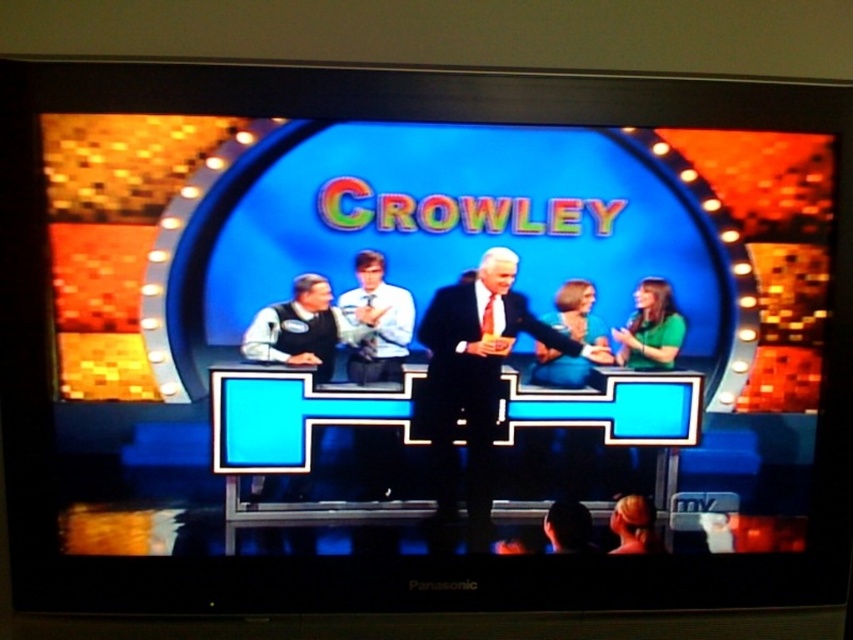
Does blonde hair at center have a smaller size compared to black hair at lower center?

Incorrect, blonde hair at center is not smaller in size than black hair at lower center.

Locate an element on the screen. blonde hair at center is located at coordinates (633, 525).

Which is behind, point (590, 326) or point (548, 516)?

Point (548, 516)

From the picture: Does green fabric dress at center appear on the right side of black hair at lower center?

Indeed, green fabric dress at center is positioned on the right side of black hair at lower center.

Is point (564, 371) positioned behind point (590, 545)?

No, it is not.

The height and width of the screenshot is (640, 853). I want to click on green fabric dress at center, so click(x=577, y=314).

I want to click on green matte shirt at right, so click(x=651, y=328).

Can you confirm if green matte shirt at right is bigger than blonde hair at center?

Yes.

Where is `green matte shirt at right`? green matte shirt at right is located at coordinates (651, 328).